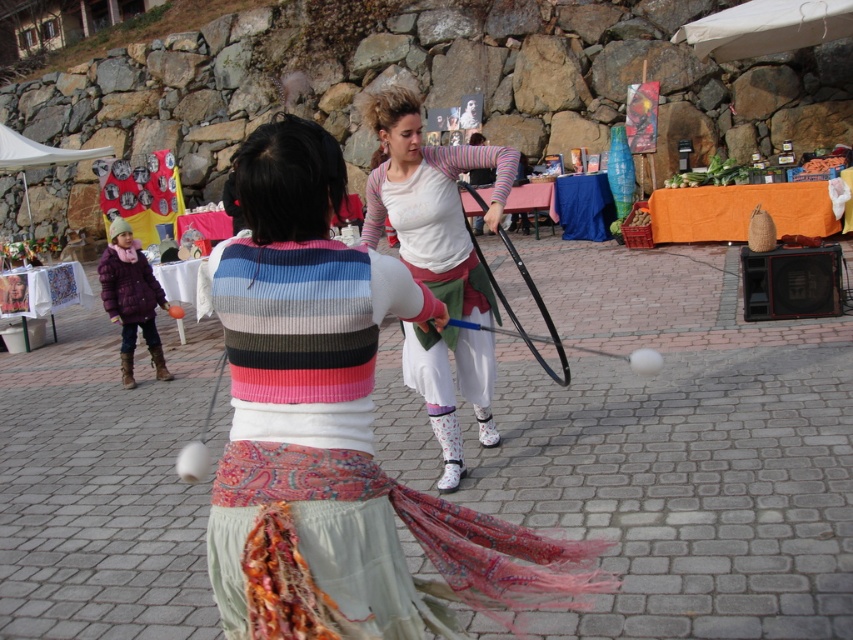
You are standing in the market scene and want to determine which of the two points, point [358,552] or point [405,257], is nearer to you. Based on the scene description, which point is closer?

Point [358,552] is closer to the viewer than point [405,257].